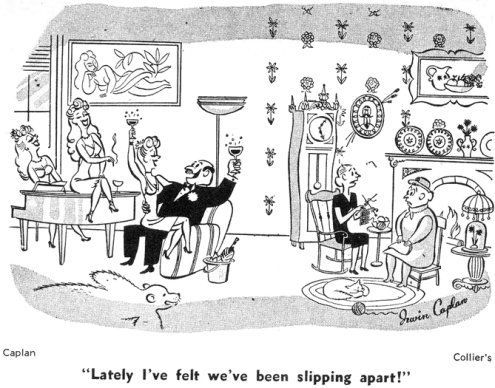
Find the location of a particular element. fireplace is located at coordinates (455, 188).